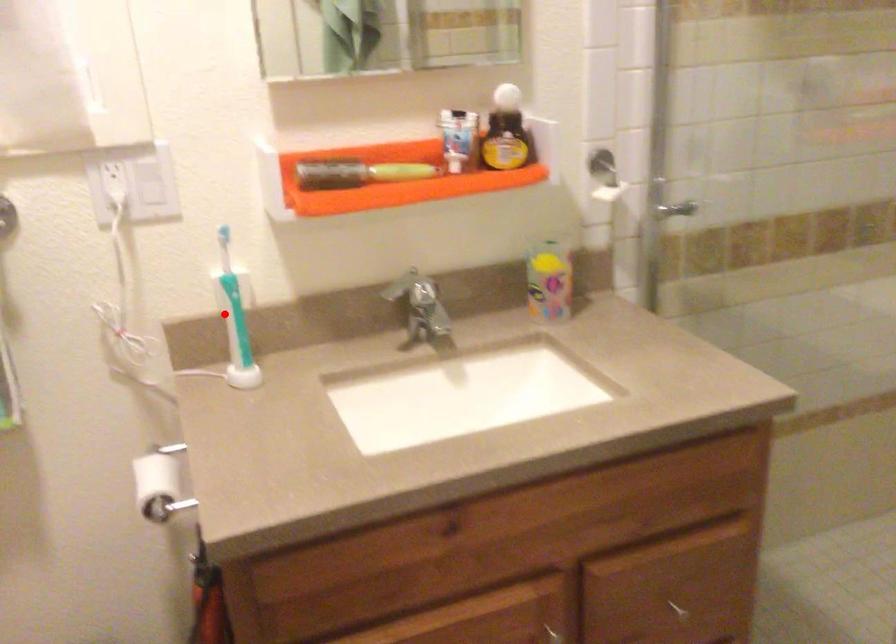
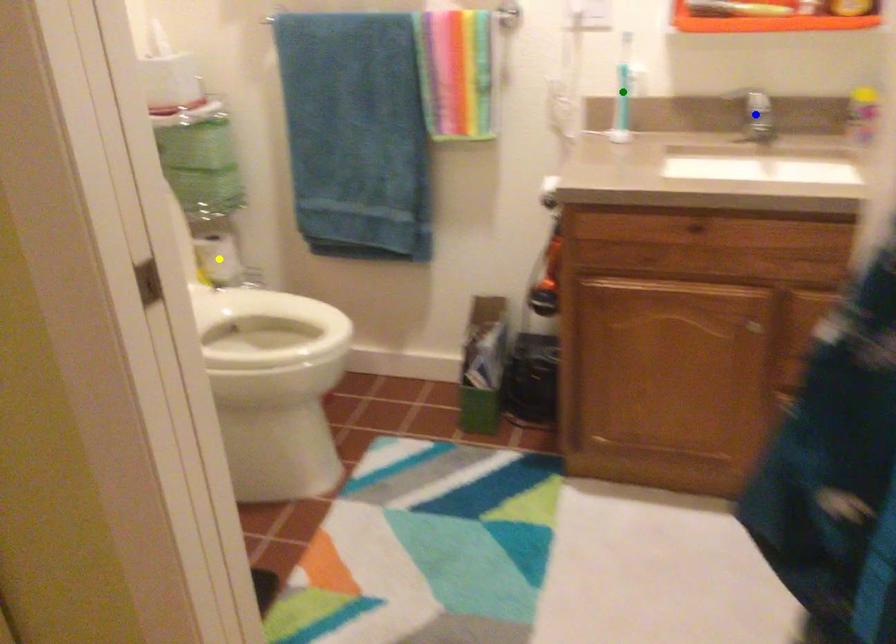
Question: I am providing you with two images of the same scene from different viewpoints. A red point is marked on the first image. You are given multiple points on the second image. Which point in image 2 is actually the same real-world point as the red point in image 1?

Choices:
 (A) green point
 (B) blue point
 (C) yellow point

Answer: (A)